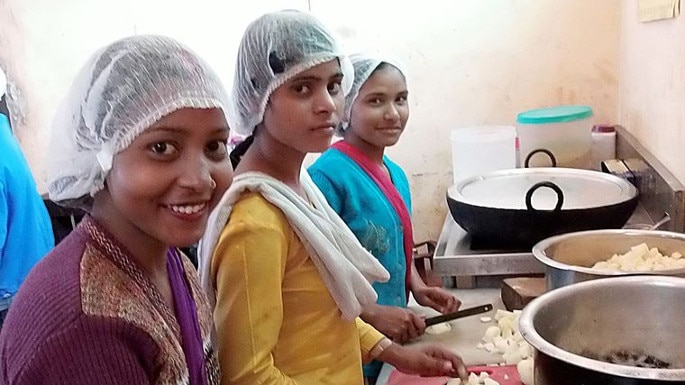
I want to click on wok, so click(x=480, y=220).